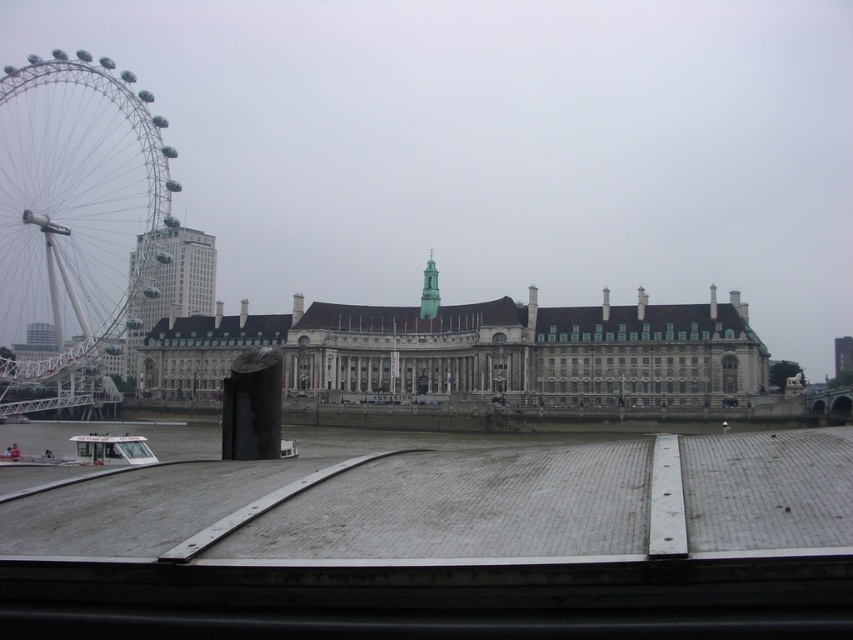
Is matte gray sky at upper center further to camera compared to stone building at center?

Yes, it is behind stone building at center.

Who is positioned more to the right, matte gray sky at upper center or stone building at center?

From the viewer's perspective, matte gray sky at upper center appears more on the right side.

Find the location of `matte gray sky at upper center`. matte gray sky at upper center is located at coordinates (502, 147).

Is matte gray sky at upper center in front of green stone tower at center?

Yes, matte gray sky at upper center is in front of green stone tower at center.

Is matte gray sky at upper center below green stone tower at center?

Incorrect, matte gray sky at upper center is not positioned below green stone tower at center.

Measure the distance between matte gray sky at upper center and camera.

They are 122.79 meters apart.

This screenshot has height=640, width=853. Identify the location of matte gray sky at upper center. (502, 147).

Does stone building at center appear on the left side of matte glass skyscraper at center-left?

Incorrect, stone building at center is not on the left side of matte glass skyscraper at center-left.

You are a GUI agent. You are given a task and a screenshot of the screen. Output one action in this format:
    pyautogui.click(x=<x>, y=<y>)
    Task: Click on the stone building at center
    This screenshot has width=853, height=640.
    Given the screenshot: What is the action you would take?
    pyautogui.click(x=474, y=352)

Identify the location of stone building at center. (474, 352).